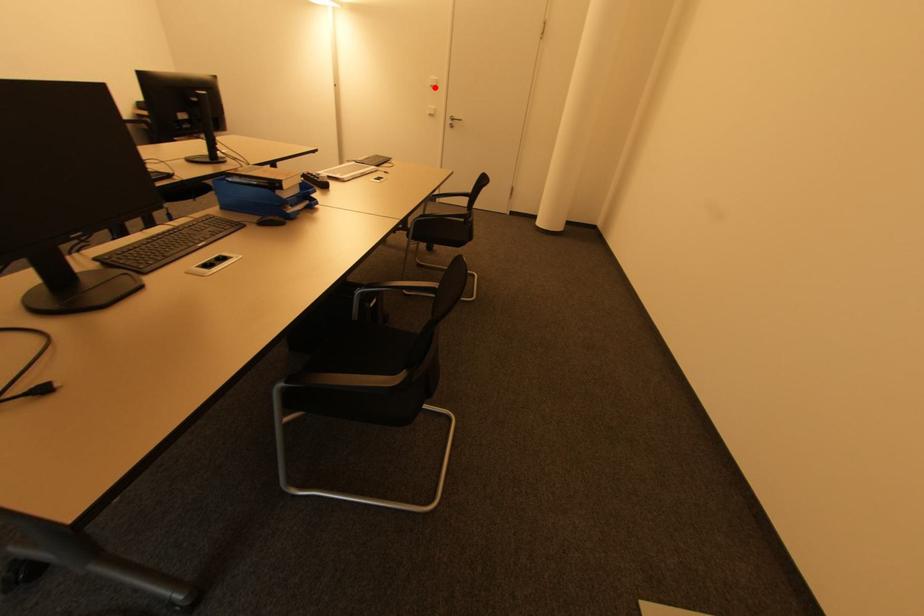
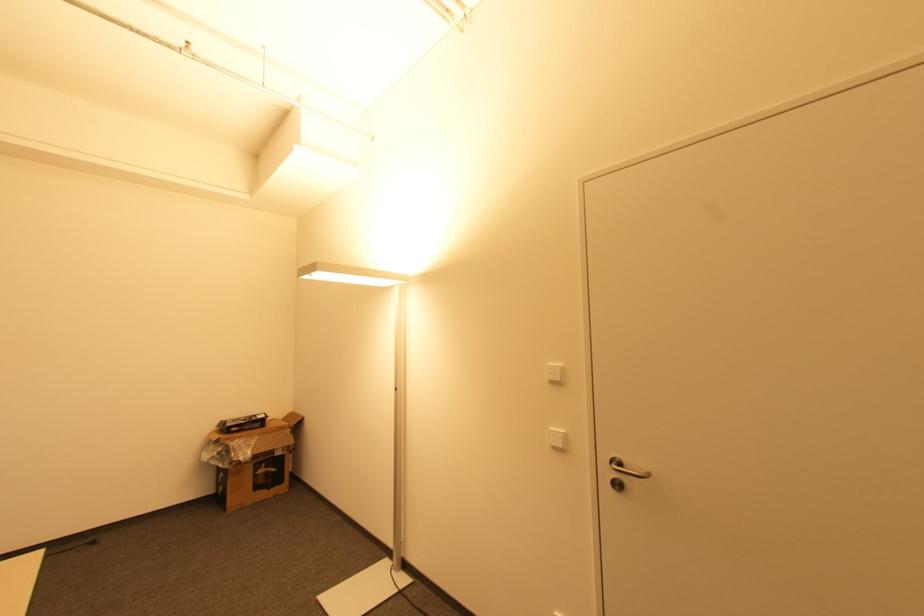
Find the pixel in the second image that matches the highlighted location in the first image.

(554, 383)